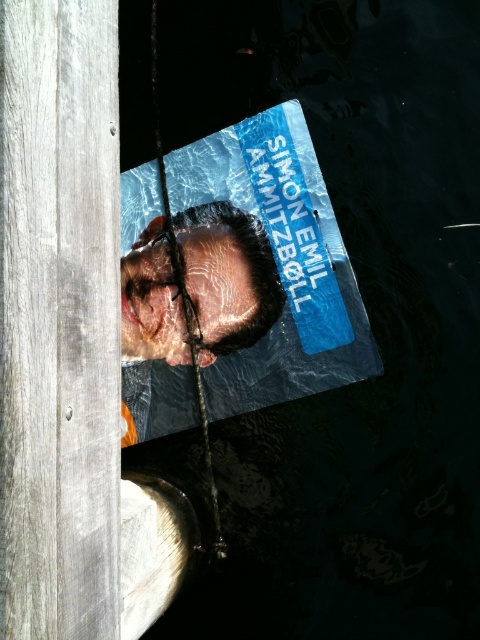
Question: Considering the relative positions of matte plastic poster at center and shiny metallic head at center in the image provided, where is matte plastic poster at center located with respect to shiny metallic head at center?

Choices:
 (A) above
 (B) below

Answer: (A)

Question: Is matte plastic poster at center above shiny metallic head at center?

Choices:
 (A) yes
 (B) no

Answer: (A)

Question: Is matte plastic poster at center to the left of shiny metallic head at center from the viewer's perspective?

Choices:
 (A) yes
 (B) no

Answer: (B)

Question: Which of the following is the farthest from the observer?

Choices:
 (A) matte plastic poster at center
 (B) shiny metallic head at center

Answer: (B)